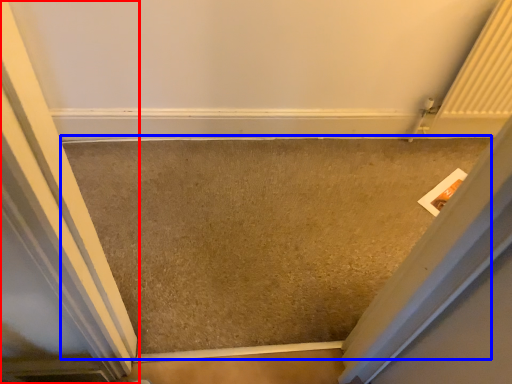
Question: Which of the following is the farthest to the observer, door (highlighted by a red box) or concrete (highlighted by a blue box)?

Choices:
 (A) door
 (B) concrete

Answer: (B)